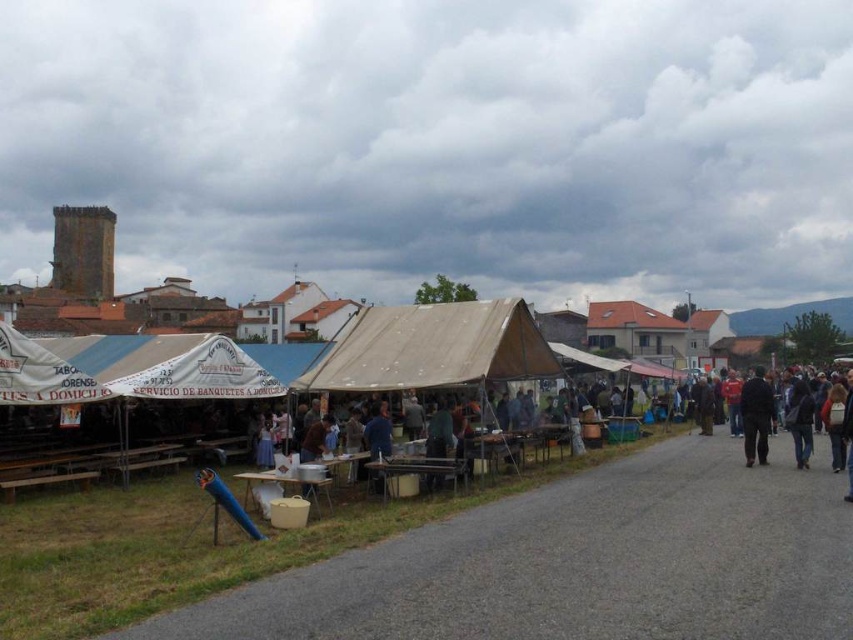
Who is positioned more to the right, beige canvas tent at center or white fabric canopy at left?

beige canvas tent at center

Locate an element on the screen. beige canvas tent at center is located at coordinates (432, 348).

Find the location of a particular element. beige canvas tent at center is located at coordinates (432, 348).

Who is lower down, beige canvas tent at center or dark blue fabric at right?

dark blue fabric at right is below.

Who is shorter, beige canvas tent at center or dark blue fabric at right?

beige canvas tent at center

Between point (495, 356) and point (759, 419), which one is positioned behind?

Point (759, 419)

You are a GUI agent. You are given a task and a screenshot of the screen. Output one action in this format:
    pyautogui.click(x=<x>, y=<y>)
    Task: Click on the beige canvas tent at center
    
    Given the screenshot: What is the action you would take?
    pyautogui.click(x=432, y=348)

Between white fabric canopy at left and dark blue fabric at right, which one is positioned lower?

Answer: Positioned lower is dark blue fabric at right.

How distant is white fabric canopy at left from dark blue fabric at right?

43.12 meters

Is point (16, 396) farther from camera compared to point (759, 458)?

That is False.

Find the location of `white fabric canopy at left`. white fabric canopy at left is located at coordinates (39, 374).